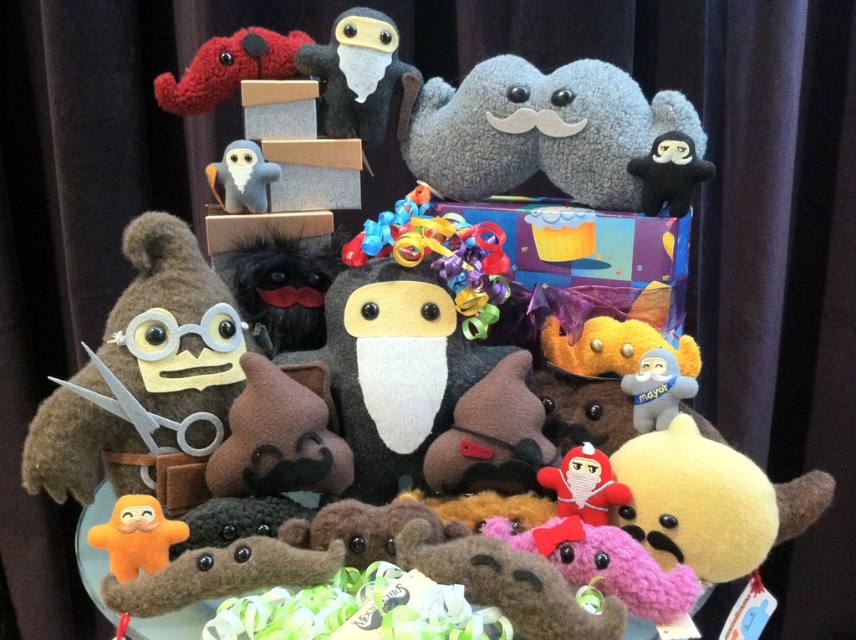
Does point (182, 92) lie in front of point (672, 134)?

No, (182, 92) is behind (672, 134).

Which is behind, point (165, 88) or point (688, 144)?

The point (165, 88) is behind.

Is point (201, 74) less distant than point (685, 173)?

No, it is not.

Find the location of a particular element. This screenshot has height=640, width=856. yarn elephant at upper left is located at coordinates (229, 68).

I want to click on yarn elephant at upper left, so click(229, 68).

Can you confirm if yarn elephant at upper left is bigger than red plush ninja at center?

Yes.

The image size is (856, 640). I want to click on yarn elephant at upper left, so click(x=229, y=68).

From the picture: Can you confirm if brown plush bear with scissors at left is shorter than orange plush toy at lower left?

Incorrect, brown plush bear with scissors at left's height does not fall short of orange plush toy at lower left's.

Does point (163, 248) lie behind point (123, 538)?

Yes, point (163, 248) is farther from viewer.

Identify the location of brown plush bear with scissors at left. This screenshot has width=856, height=640. (147, 381).